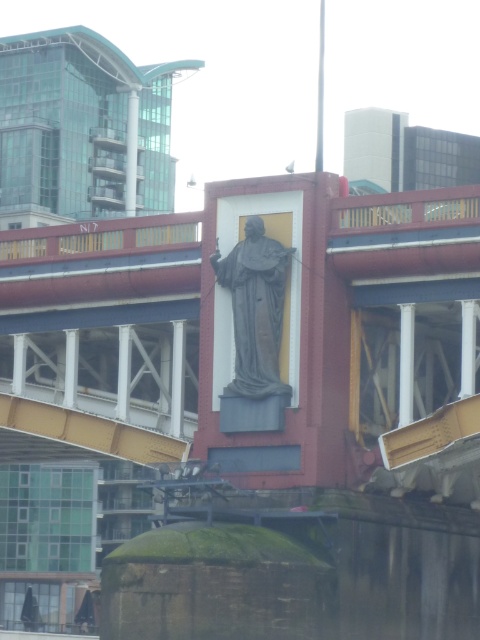
You are standing on the concrete bridge at center and want to reach the gray stone statue at center. Which direction should you move towards?

The concrete bridge at center is to the left of gray stone statue at center, so you should move to the right to reach the gray stone statue at center.

Based on the photo, you are an architect examining the image. You need to determine if the gray stone statue at center can be placed on the concrete bridge at center without exceeding its dimensions. Based on the size comparison between the two, what is your conclusion?

The concrete bridge at center is bigger than the gray stone statue at center, so the statue can be placed on the bridge without exceeding its dimensions.